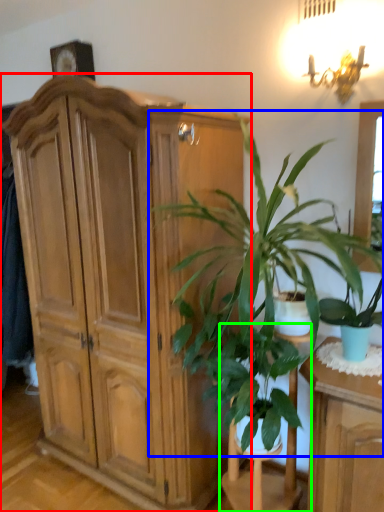
Question: Estimate the real-world distances between objects in this image. Which object is closer to cabinetry (highlighted by a red box), houseplant (highlighted by a blue box) or armchair (highlighted by a green box)?

Choices:
 (A) houseplant
 (B) armchair

Answer: (A)